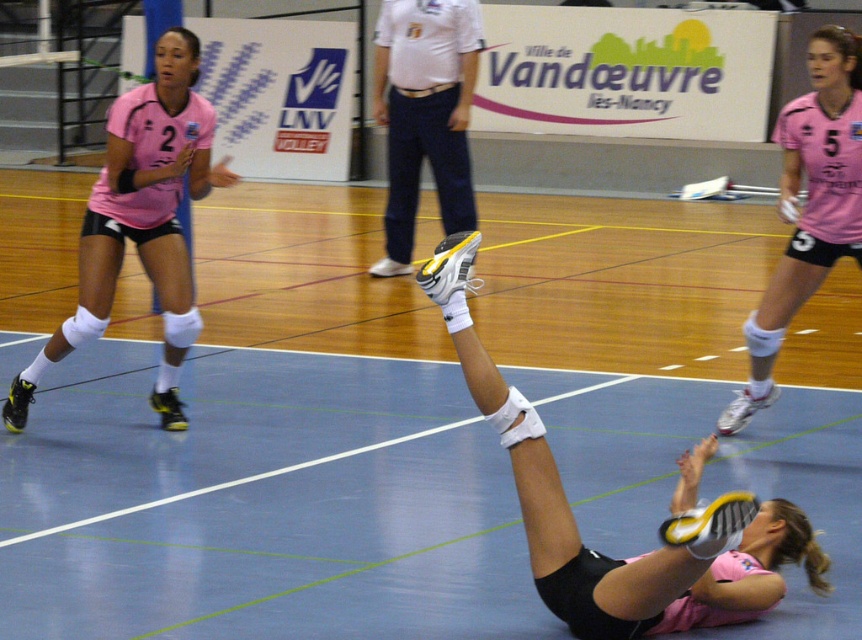
Question: Which object is positioned closest to the white leather shoe at center?

Choices:
 (A) pink matte jersey at left
 (B) matte pink shorts at lower right
 (C) pink jersey at upper right

Answer: (A)

Question: Observing the image, what is the correct spatial positioning of matte pink shorts at lower right in reference to white leather shoe at center?

Choices:
 (A) left
 (B) right

Answer: (B)

Question: Can you confirm if matte pink shorts at lower right is wider than white leather shoe at center?

Choices:
 (A) no
 (B) yes

Answer: (B)

Question: Which of the following is the farthest from the observer?

Choices:
 (A) (586, 604)
 (B) (806, 97)
 (C) (409, 99)
 (D) (109, 301)

Answer: (C)

Question: Does matte pink shorts at lower right have a lesser width compared to pink matte jersey at left?

Choices:
 (A) no
 (B) yes

Answer: (A)

Question: Which object is positioned closest to the pink jersey at upper right?

Choices:
 (A) pink matte jersey at left
 (B) white leather shoe at center
 (C) matte pink shorts at lower right

Answer: (C)